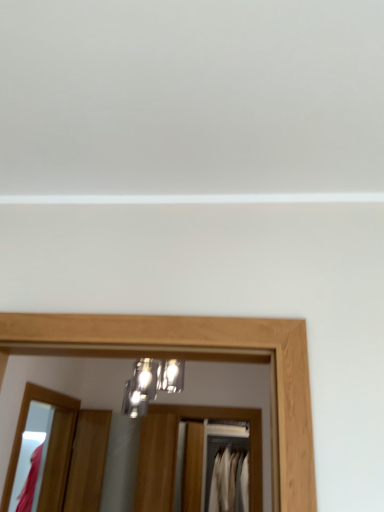
Question: From their relative heights in the image, would you say matte wooden mirror at lower left is taller or shorter than metallic glass light fixture at center?

Choices:
 (A) short
 (B) tall

Answer: (B)

Question: Is matte wooden mirror at lower left to the left or to the right of metallic glass light fixture at center in the image?

Choices:
 (A) left
 (B) right

Answer: (A)

Question: Considering the real-world distances, which object is closest to the white fabric at center, marked as the first clothing in a back-to-front arrangement?

Choices:
 (A) matte pink fabric at left, the second clothing in the back-to-front sequence
 (B) matte wooden mirror at lower left
 (C) wooden door at lower left
 (D) metallic glass light fixture at center

Answer: (C)

Question: Which of these objects is positioned closest to the matte wooden mirror at lower left?

Choices:
 (A) matte pink fabric at left, the second clothing in the back-to-front sequence
 (B) white fabric at center, marked as the 2th clothing in a left-to-right arrangement
 (C) wooden door at lower left
 (D) metallic glass light fixture at center

Answer: (C)